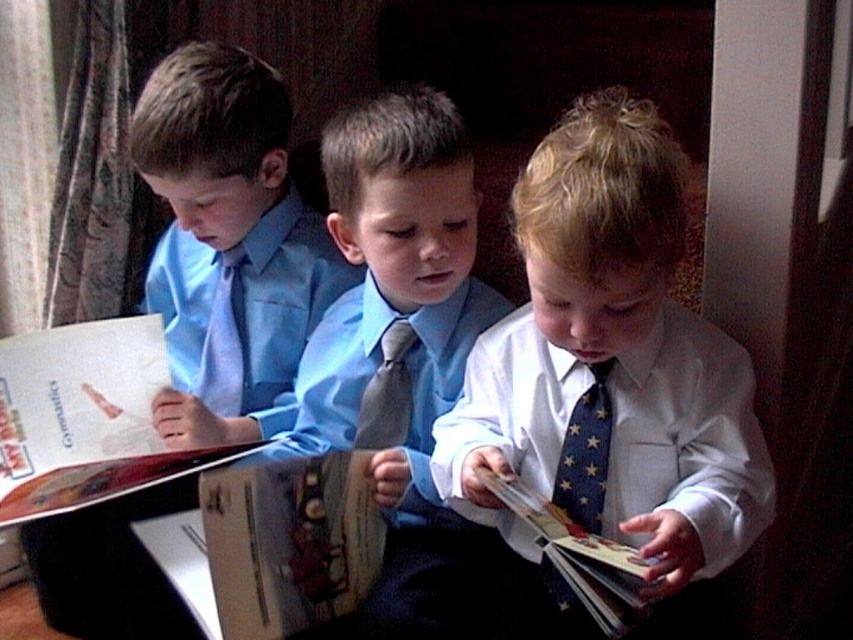
This screenshot has height=640, width=853. Identify the location of matte blue shirt at left. (228, 244).

Which is in front, point (265, 250) or point (221, 323)?

Point (265, 250)

Identify the location of matte blue shirt at left. Image resolution: width=853 pixels, height=640 pixels. (228, 244).

Is blue star-patterned tie at center to the right of dark gray textured tie at center from the viewer's perspective?

Indeed, blue star-patterned tie at center is positioned on the right side of dark gray textured tie at center.

Can you confirm if blue star-patterned tie at center is smaller than dark gray textured tie at center?

No.

Is point (573, 420) positioned in front of point (378, 387)?

That is True.

Image resolution: width=853 pixels, height=640 pixels. I want to click on blue star-patterned tie at center, so click(585, 454).

Does matte blue shirt at left appear on the left side of blue fabric book at center?

Yes, matte blue shirt at left is to the left of blue fabric book at center.

Does matte blue shirt at left have a greater height compared to blue fabric book at center?

Yes, matte blue shirt at left is taller than blue fabric book at center.

Locate an element on the screen. This screenshot has width=853, height=640. matte blue shirt at left is located at coordinates (228, 244).

Image resolution: width=853 pixels, height=640 pixels. Find the location of `matte blue shirt at left`. matte blue shirt at left is located at coordinates (228, 244).